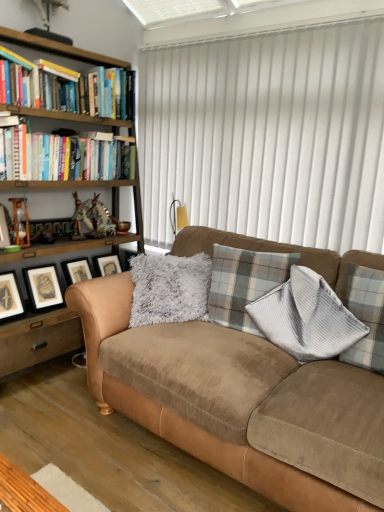
Question: Should I look upward or downward to see wooden picture frame at left, which appears as the 2th picture frame when viewed from the right?

Choices:
 (A) down
 (B) up

Answer: (B)

Question: Could you tell me if hardcover books at left is facing white vertical blinds at upper center?

Choices:
 (A) yes
 (B) no

Answer: (A)

Question: From the image's perspective, is hardcover books at left on top of white vertical blinds at upper center?

Choices:
 (A) no
 (B) yes

Answer: (A)

Question: Is hardcover books at left positioned in front of white vertical blinds at upper center?

Choices:
 (A) yes
 (B) no

Answer: (B)

Question: Is hardcover books at left smaller than white vertical blinds at upper center?

Choices:
 (A) yes
 (B) no

Answer: (A)

Question: Considering the relative positions of hardcover books at left and white vertical blinds at upper center in the image provided, is hardcover books at left to the left of white vertical blinds at upper center from the viewer's perspective?

Choices:
 (A) no
 (B) yes

Answer: (B)

Question: Can you confirm if hardcover books at left is shorter than white vertical blinds at upper center?

Choices:
 (A) yes
 (B) no

Answer: (A)

Question: Would you say suede couch at center is a long distance from black matte picture frame at lower left, acting as the 2th picture frame starting from the top?

Choices:
 (A) no
 (B) yes

Answer: (B)

Question: Can we say suede couch at center lies outside black matte picture frame at lower left, acting as the 2th picture frame starting from the top?

Choices:
 (A) no
 (B) yes

Answer: (B)

Question: Is suede couch at center bigger than black matte picture frame at lower left, positioned as the first picture frame in back-to-front order?

Choices:
 (A) no
 (B) yes

Answer: (B)

Question: Does suede couch at center have a lesser height compared to black matte picture frame at lower left, which ranks as the 2th picture frame in left-to-right order?

Choices:
 (A) yes
 (B) no

Answer: (B)

Question: Can black matte picture frame at lower left, positioned as the first picture frame in back-to-front order, be found inside suede couch at center?

Choices:
 (A) yes
 (B) no

Answer: (B)

Question: Does suede couch at center have a smaller size compared to black matte picture frame at lower left, which ranks as the 2th picture frame in left-to-right order?

Choices:
 (A) yes
 (B) no

Answer: (B)

Question: Is plaid fabric pillow at center at the left side of wooden picture frame at left, positioned as the first picture frame in front-to-back order?

Choices:
 (A) yes
 (B) no

Answer: (B)